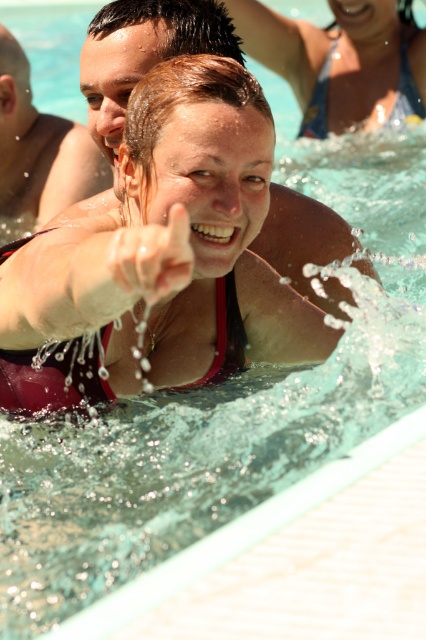
You are a photographer at the water park and want to capture a photo of the matte pink swimsuit at center and the matte pink bikini top at upper center. Which object should you focus on first if you want to include both in the frame without moving the camera?

The matte pink swimsuit at center is to the left of the matte pink bikini top at upper center, so you should focus on the matte pink swimsuit at center first to ensure both are in the frame.

In the image of the water park scene, you notice the matte pink bikini top at upper center and the smooth skin face at upper center. Which of these two items appears bigger in the picture?

The matte pink bikini top at upper center has a larger size compared to the smooth skin face at upper center, so the matte pink bikini top at upper center appears bigger in the picture.

You are a photographer trying to capture the perfect shot of the two points in the image. The first point is at coordinate point [255,317] and the second is at point [54,145]. Which point will appear larger in your photo?

Point [255,317] is closer to the camera than point [54,145], so it will appear larger in the photo.